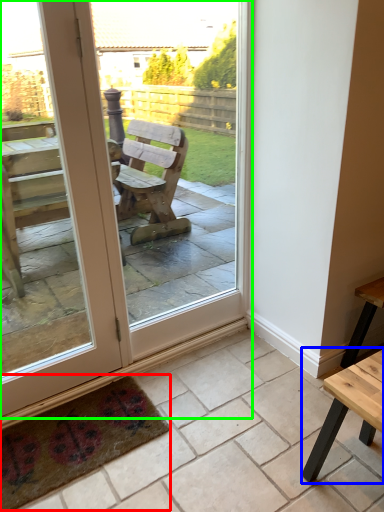
Question: Which object is positioned closest to mat (highlighted by a red box)? Select from table (highlighted by a blue box) and door (highlighted by a green box).

Choices:
 (A) table
 (B) door

Answer: (B)